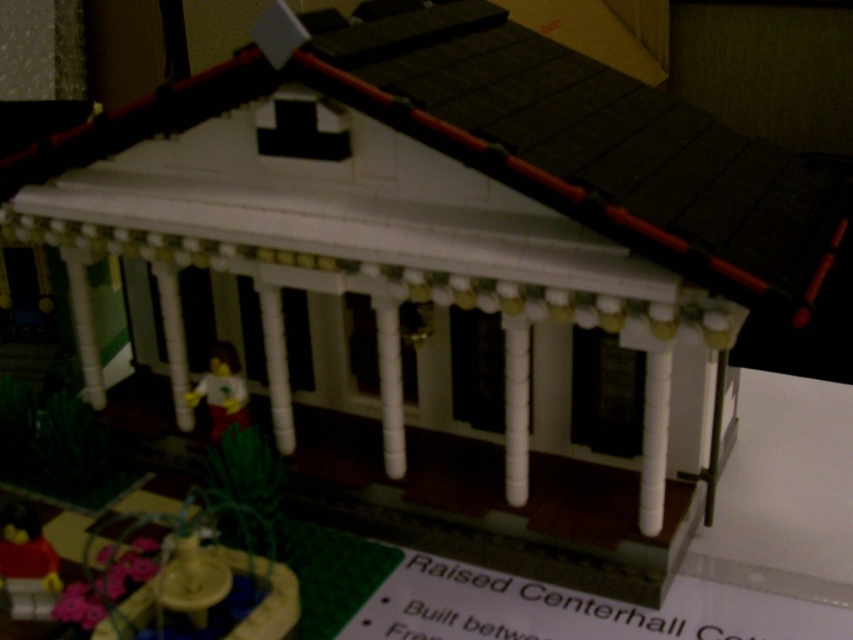
Question: Which is farther from the smooth yellow figure at center?

Choices:
 (A) smooth yellow fountain at lower left
 (B) red plastic figure at lower left

Answer: (B)

Question: Which object appears farthest from the camera in this image?

Choices:
 (A) smooth yellow fountain at lower left
 (B) red plastic figure at lower left

Answer: (B)

Question: Can you confirm if red plastic figure at lower left is positioned above smooth yellow figure at center?

Choices:
 (A) no
 (B) yes

Answer: (A)

Question: Is red plastic figure at lower left below smooth yellow figure at center?

Choices:
 (A) yes
 (B) no

Answer: (A)

Question: Can you confirm if smooth yellow fountain at lower left is positioned above smooth yellow figure at center?

Choices:
 (A) no
 (B) yes

Answer: (A)

Question: Among these objects, which one is nearest to the camera?

Choices:
 (A) red plastic figure at lower left
 (B) smooth yellow fountain at lower left
 (C) smooth yellow figure at center

Answer: (B)